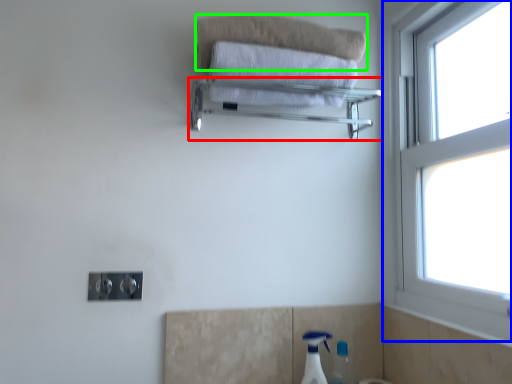
Question: Which is farther away from balustrade (highlighted by a red box)? window (highlighted by a blue box) or bath towel (highlighted by a green box)?

Choices:
 (A) window
 (B) bath towel

Answer: (A)